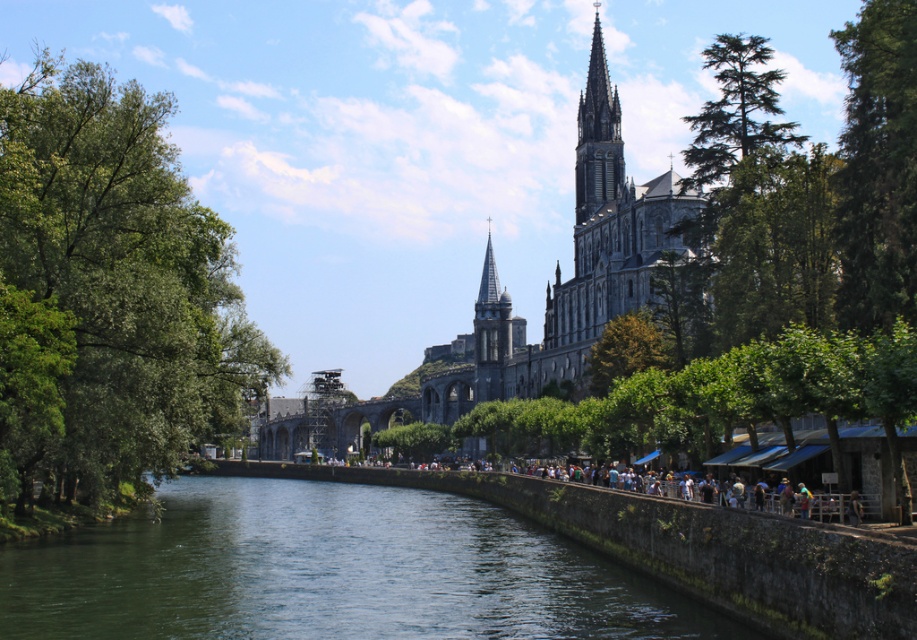
Question: Which point is farther to the camera?

Choices:
 (A) green needle-like foliage at upper right
 (B) green leafy tree at left

Answer: (A)

Question: From the image, what is the correct spatial relationship of green leafy tree at left in relation to greenish water at center?

Choices:
 (A) left
 (B) right

Answer: (A)

Question: Does green leafy tree at left appear on the right side of greenish water at center?

Choices:
 (A) no
 (B) yes

Answer: (A)

Question: Estimate the real-world distances between objects in this image. Which object is farther from the green needle-like foliage at upper right?

Choices:
 (A) green leafy tree at left
 (B) gray stone church at center

Answer: (A)

Question: Which object is positioned closest to the green leafy tree at left?

Choices:
 (A) greenish water at center
 (B) gray stone church at center

Answer: (A)

Question: In this image, where is gray stone church at center located relative to green needle-like foliage at upper right?

Choices:
 (A) left
 (B) right

Answer: (A)